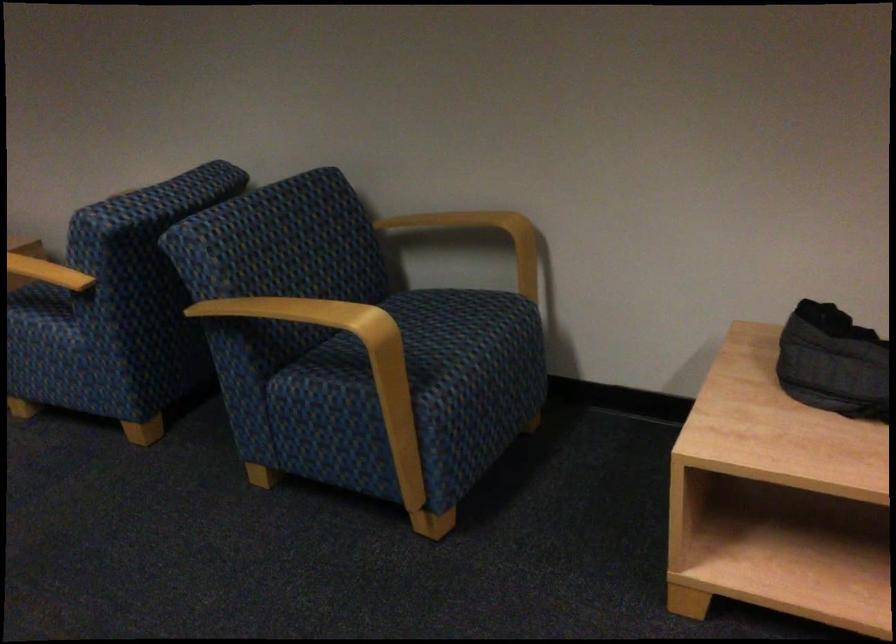
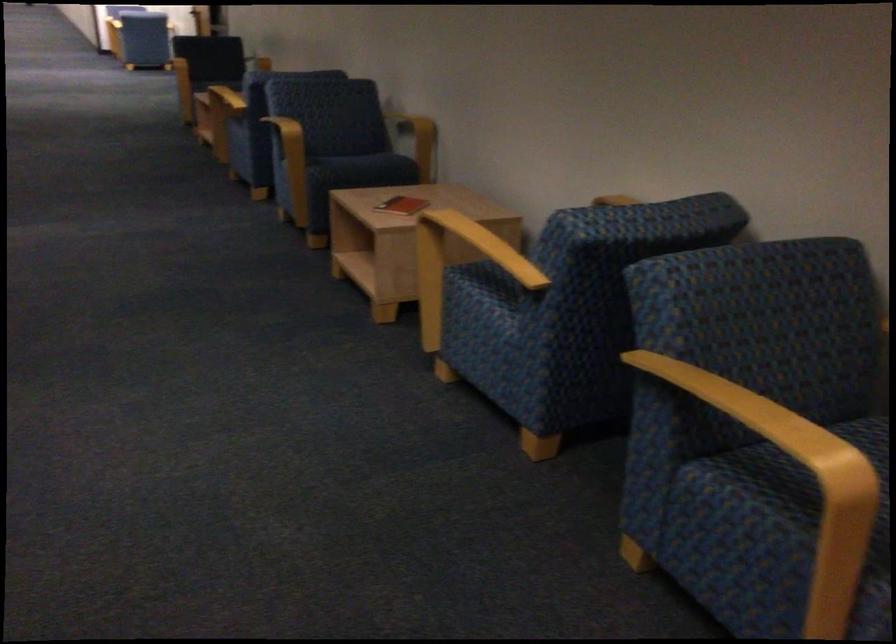
The point at (341, 391) is marked in the first image. Where is the corresponding point in the second image?

(763, 515)